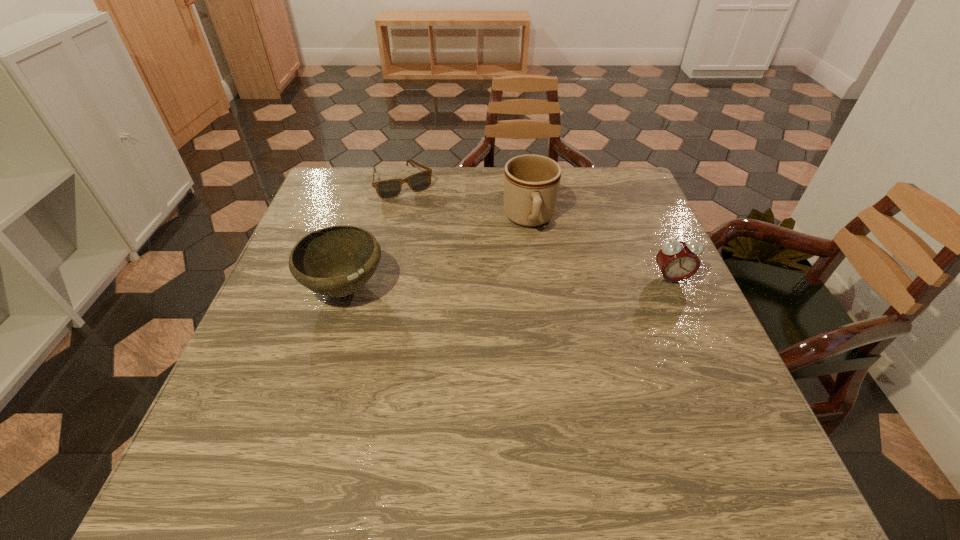
Locate an element on the screen. The image size is (960, 540). free area in between the second object from right to left and the bowl is located at coordinates (437, 253).

Image resolution: width=960 pixels, height=540 pixels. Find the location of `vacant area between the alarm clock and the mug`. vacant area between the alarm clock and the mug is located at coordinates (600, 249).

You are a GUI agent. You are given a task and a screenshot of the screen. Output one action in this format:
    pyautogui.click(x=<x>, y=<y>)
    Task: Click on the free spot between the bowl and the shortest object
    The image size is (960, 540).
    Given the screenshot: What is the action you would take?
    (374, 235)

Locate an element on the screen. vacant region between the bowl and the shortest object is located at coordinates tap(374, 235).

The height and width of the screenshot is (540, 960). I want to click on vacant area that lies between the alarm clock and the mug, so click(x=600, y=249).

Locate an element on the screen. free space between the sunglasses and the second object from right to left is located at coordinates (467, 201).

Find the location of `object that stands as the second closest to the bowl`. object that stands as the second closest to the bowl is located at coordinates (531, 182).

Locate which object ranks third in proximity to the bowl. Please provide its 2D coordinates. Your answer should be formatted as a tuple, i.e. [(x, y)], where the tuple contains the x and y coordinates of a point satisfying the conditions above.

[(677, 260)]

The width and height of the screenshot is (960, 540). In order to click on vacant position in the image that satisfies the following two spatial constraints: 1. on the back side of the bowl; 2. on the right side of the third object from left to right in this screenshot , I will do `click(366, 219)`.